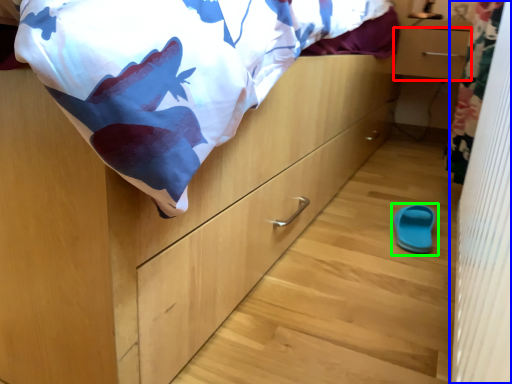
Question: Which object is positioned closest to drawer (highlighted by a red box)? Select from curtain (highlighted by a blue box) and footwear (highlighted by a green box).

Choices:
 (A) curtain
 (B) footwear

Answer: (B)